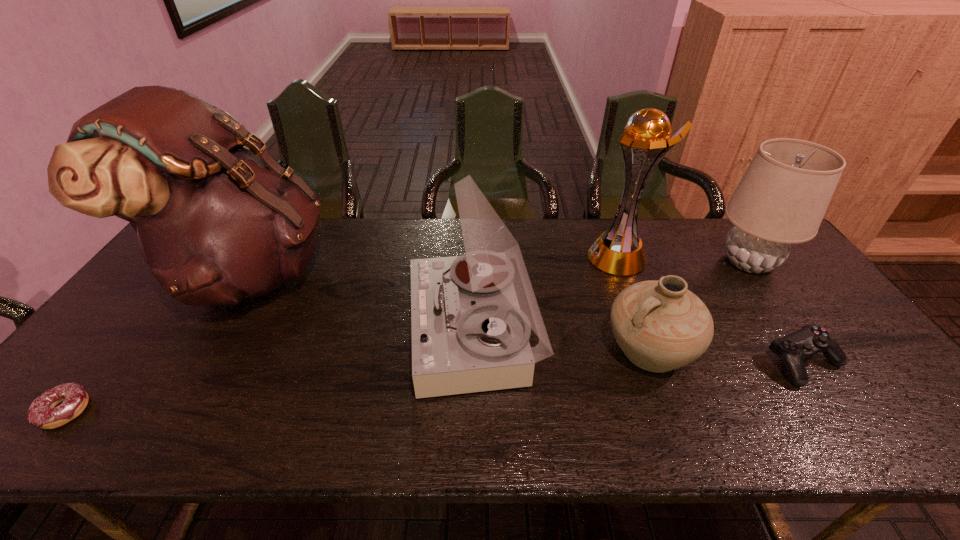
At what (x,y) coordinates should I click in order to perform the action: click on satchel that is at the left edge. Please return your answer as a coordinate pair (x, y). Looking at the image, I should click on (216, 222).

Locate an element on the screen. doughnut present at the left edge is located at coordinates [x=43, y=413].

Find the location of a particular element. lampshade that is at the right edge is located at coordinates (782, 198).

At what (x,y) coordinates should I click in order to perform the action: click on control that is positioned at the right edge. Please return your answer as a coordinate pair (x, y). The height and width of the screenshot is (540, 960). Looking at the image, I should click on (800, 345).

I want to click on object positioned at the far left corner, so click(x=216, y=222).

Locate an element on the screen. object at the near left corner is located at coordinates (43, 413).

Image resolution: width=960 pixels, height=540 pixels. I want to click on object situated at the far right corner, so click(x=782, y=198).

You are a GUI agent. You are given a task and a screenshot of the screen. Output one action in this format:
    pyautogui.click(x=<x>, y=<y>)
    Task: Click on the vacant position at the far edge of the desktop
    The height and width of the screenshot is (540, 960).
    Given the screenshot: What is the action you would take?
    pyautogui.click(x=556, y=254)

Locate an element on the screen. The height and width of the screenshot is (540, 960). vacant space at the near edge is located at coordinates (158, 413).

Find the location of a particular element. The height and width of the screenshot is (540, 960). vacant position at the left edge of the desktop is located at coordinates (139, 327).